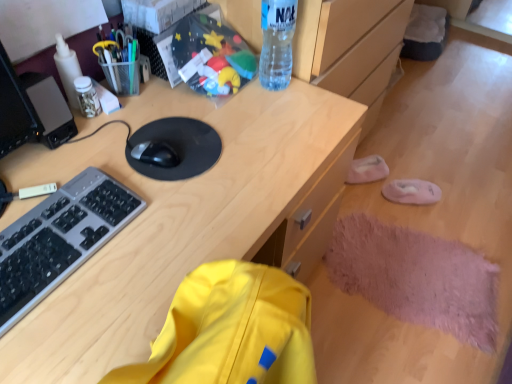
Find the location of a particular element. The width and height of the screenshot is (512, 384). free space in front of white plastic bottle at upper left, the 2th bottle from the right is located at coordinates (71, 146).